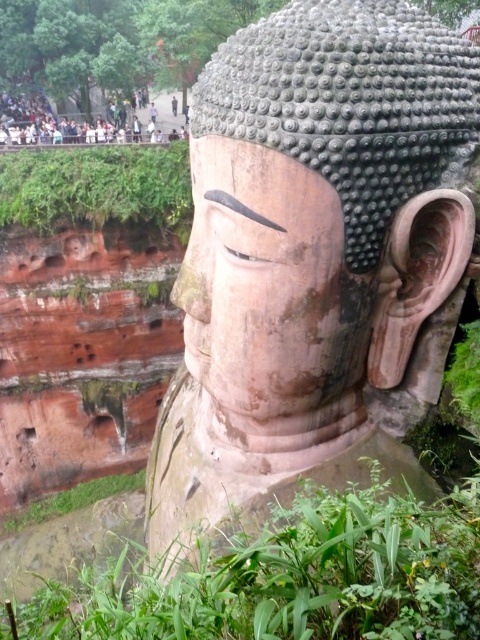
Between smooth stone statue at center and smooth stone face at center, which one appears on the left side from the viewer's perspective?

From the viewer's perspective, smooth stone statue at center appears more on the left side.

Where is `smooth stone statue at center`? Image resolution: width=480 pixels, height=640 pixels. smooth stone statue at center is located at coordinates (313, 257).

Which is behind, point (265, 468) or point (262, 339)?

Positioned behind is point (265, 468).

Where is `smooth stone statue at center`? This screenshot has width=480, height=640. smooth stone statue at center is located at coordinates (313, 257).

Can you confirm if smooth stone statue at center is positioned to the left of green leafy plant at lower center?

Indeed, smooth stone statue at center is positioned on the left side of green leafy plant at lower center.

Identify the location of smooth stone statue at center. (313, 257).

Who is more forward, (450, 317) or (232, 604)?

Point (232, 604) is in front.

Find the location of `smooth stone statue at center`. smooth stone statue at center is located at coordinates (313, 257).

Does point (282, 349) lie behind point (152, 202)?

No.

Measure the distance between smooth stone statue at center and camera.

smooth stone statue at center is 25.14 feet from camera.

Where is `smooth stone statue at center`? smooth stone statue at center is located at coordinates (313, 257).